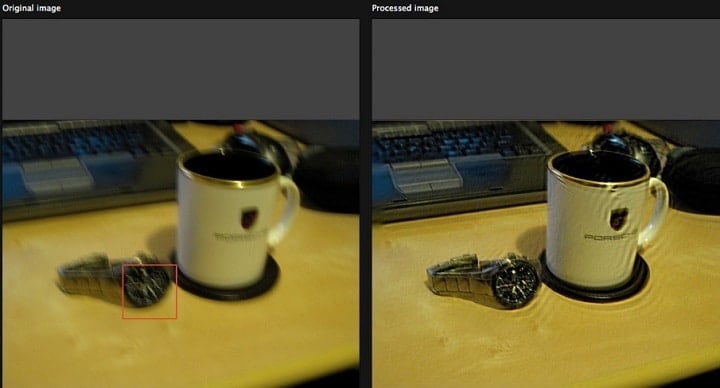
The height and width of the screenshot is (388, 720). I want to click on computer mouse, so click(626, 146), click(260, 143).